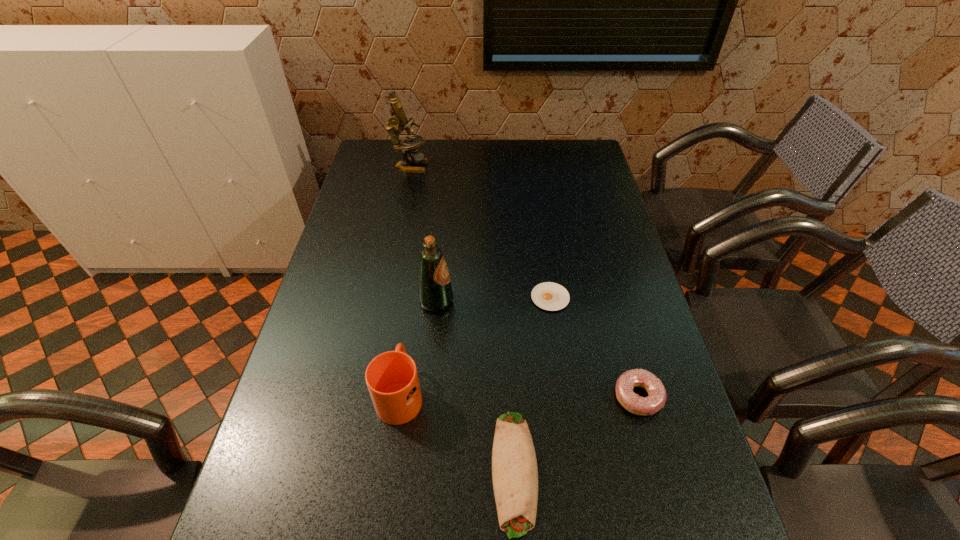
Locate an element on the screen. This screenshot has width=960, height=540. free region located on the handle side of the mug is located at coordinates (416, 282).

Find the location of a particular element. This screenshot has height=540, width=960. vacant space located on the handle side of the mug is located at coordinates (409, 332).

Identify the location of free space located on the handle side of the mug. (412, 309).

Where is `vacant space located on the back of the rightmost object`? vacant space located on the back of the rightmost object is located at coordinates (628, 358).

At what (x,y) coordinates should I click in order to perform the action: click on free region located on the front of the shortest object. Please return your answer as a coordinate pair (x, y). Image resolution: width=960 pixels, height=540 pixels. Looking at the image, I should click on (566, 407).

Where is `object present at the far edge`? object present at the far edge is located at coordinates (398, 118).

The width and height of the screenshot is (960, 540). In order to click on object present at the left edge in this screenshot , I will do `click(398, 118)`.

Locate an element on the screen. This screenshot has height=540, width=960. object present at the right edge is located at coordinates (632, 402).

Where is `object located in the far left corner section of the desktop`? This screenshot has height=540, width=960. object located in the far left corner section of the desktop is located at coordinates (398, 118).

You are a GUI agent. You are given a task and a screenshot of the screen. Output one action in this format:
    pyautogui.click(x=<x>, y=<y>)
    Task: Click on the free space at the far edge
    
    Given the screenshot: What is the action you would take?
    pyautogui.click(x=502, y=151)